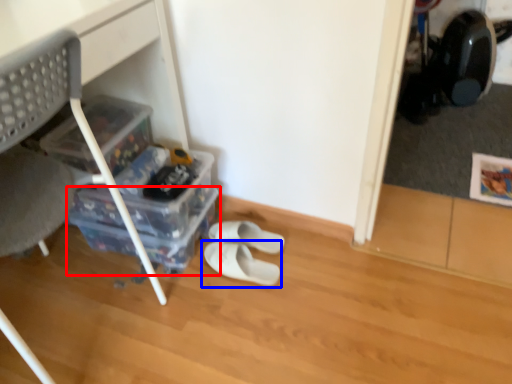
Question: Which object is closer to the camera taking this photo, storage box (highlighted by a red box) or footwear (highlighted by a blue box)?

Choices:
 (A) storage box
 (B) footwear

Answer: (B)